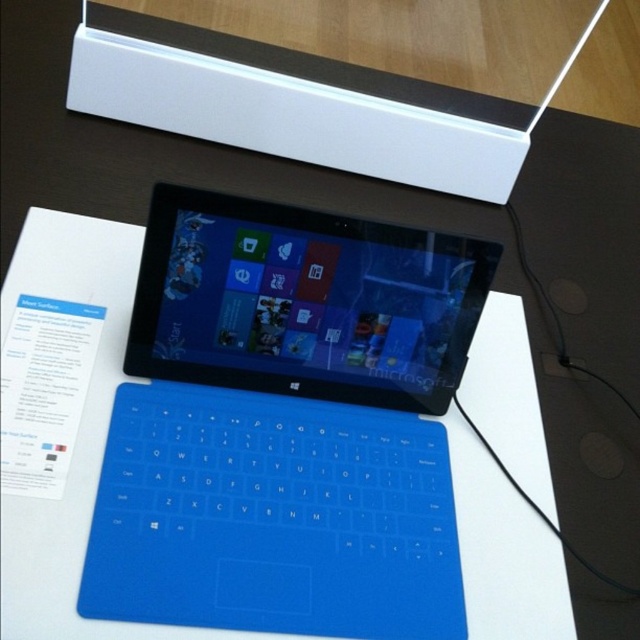
You are setting up a new Microsoft Surface tablet and need to place both the blue matte keyboard at center and the white plastic box at upper center on a desk. Given that the desk has limited space, which object should you place first to ensure both fit properly?

The blue matte keyboard at center is taller than the white plastic box at upper center. Since the keyboard takes up more vertical space, you should place it first to accommodate its height and ensure there is enough room for both objects on the desk.

You are setting up a new Microsoft Surface tablet and need to place both the blue matte keyboard at center and the white plastic box at upper center on a desk. If the desk has limited space, which object should you prioritize placing first to ensure it fits?

The blue matte keyboard at center is bigger than the white plastic box at upper center, so you should prioritize placing the blue matte keyboard at center first to ensure it fits on the desk.

Looking at this image, you are setting up a Microsoft Surface tablet and need to place the blue matte keyboard at center and the white plastic box at upper center on a desk. If the desk is 20 inches wide, will both items fit side by side without overlapping?

The blue matte keyboard at center is 16.11 inches away from the white plastic box at upper center. Since the desk is 20 inches wide, and the total distance between them is less than the desk width, they can fit side by side without overlapping.